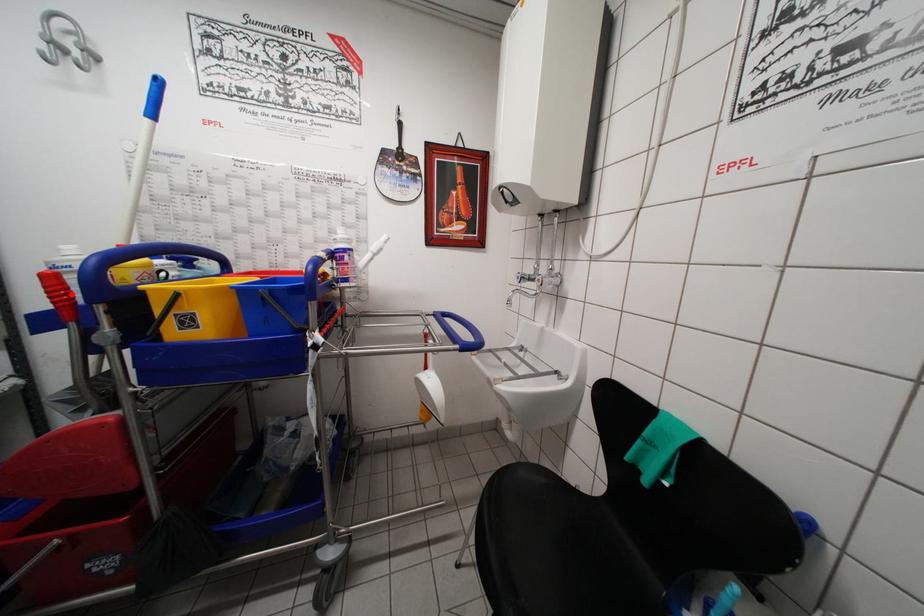
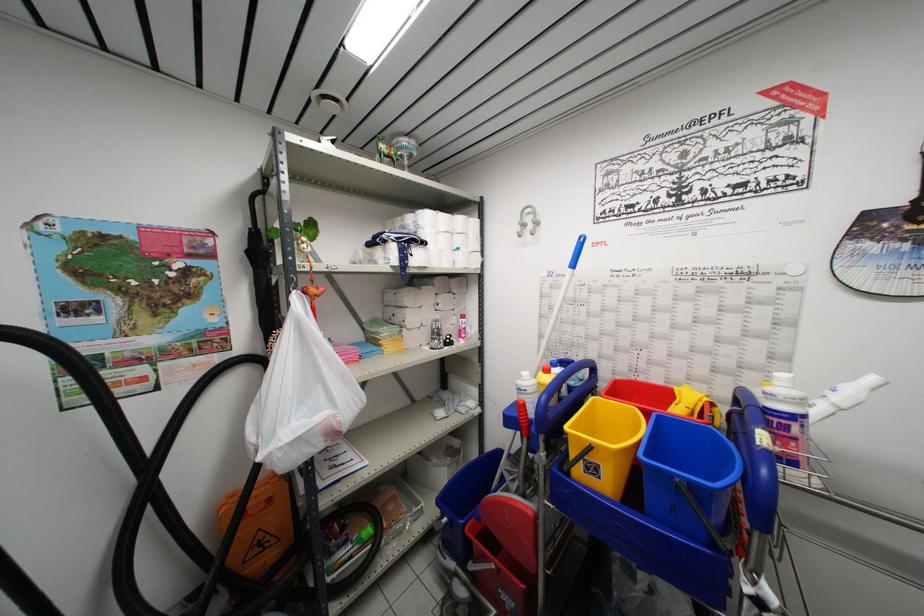
Locate, in the second image, the point that corresponds to the highlighted location in the first image.

(530, 419)